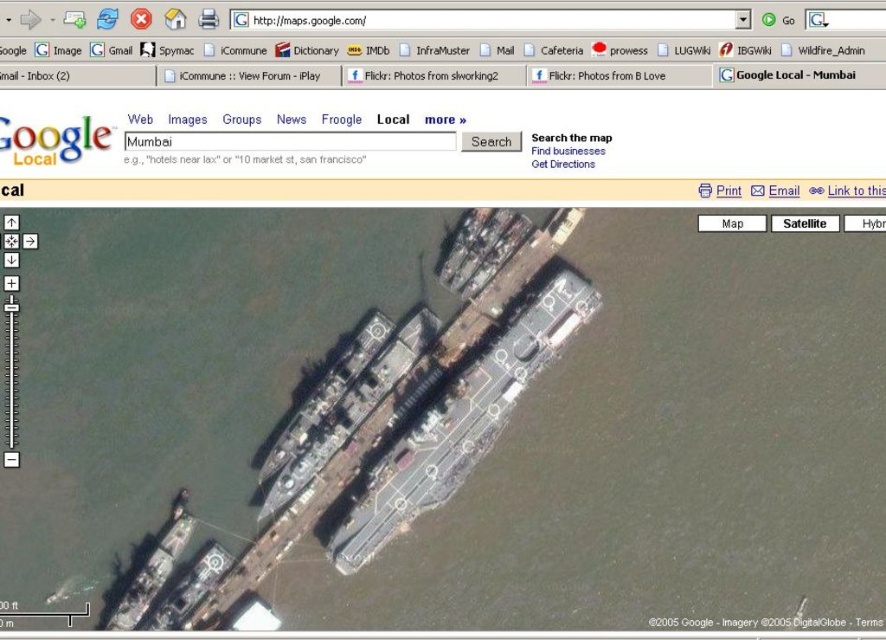
Question: Is dark gray metallic aircraft carrier at center positioned in front of dark gray metallic boat at lower left?

Choices:
 (A) yes
 (B) no

Answer: (A)

Question: Which object appears farthest from the camera in this image?

Choices:
 (A) dark gray metallic boat at lower left
 (B) gray water at center
 (C) dark gray metallic aircraft carrier at center

Answer: (B)

Question: Which point appears farthest from the camera in this image?

Choices:
 (A) (556, 346)
 (B) (713, 451)
 (C) (128, 621)
 (D) (175, 589)

Answer: (C)

Question: Is gray water at center smaller than dark gray metallic aircraft carrier at center?

Choices:
 (A) yes
 (B) no

Answer: (B)

Question: Is gray water at center to the left of dark gray metallic aircraft carrier at center from the viewer's perspective?

Choices:
 (A) no
 (B) yes

Answer: (B)

Question: Which object is closer to the camera taking this photo?

Choices:
 (A) metallic gray boat at lower left
 (B) gray water at center
 (C) dark gray metallic boat at lower left

Answer: (C)